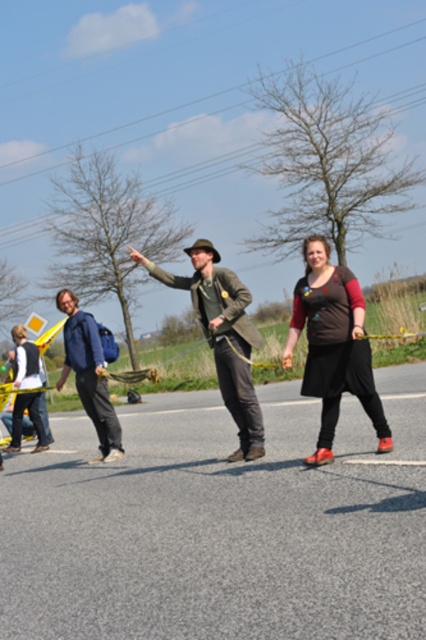
Question: Does brown matte dress at center have a greater width compared to blue denim jacket at center?

Choices:
 (A) yes
 (B) no

Answer: (A)

Question: Does brown matte dress at center lie in front of green canvas jacket at center?

Choices:
 (A) no
 (B) yes

Answer: (B)

Question: Among these points, which one is nearest to the camera?

Choices:
 (A) (109, 408)
 (B) (258, 413)

Answer: (B)

Question: Is brown matte dress at center wider than blue denim jacket at center?

Choices:
 (A) yes
 (B) no

Answer: (A)

Question: Which object appears closest to the camera in this image?

Choices:
 (A) brown matte dress at center
 (B) green canvas jacket at center
 (C) blue denim jacket at center

Answer: (A)

Question: Among these objects, which one is farthest from the camera?

Choices:
 (A) green canvas jacket at center
 (B) brown matte dress at center
 (C) blue denim jacket at center

Answer: (C)